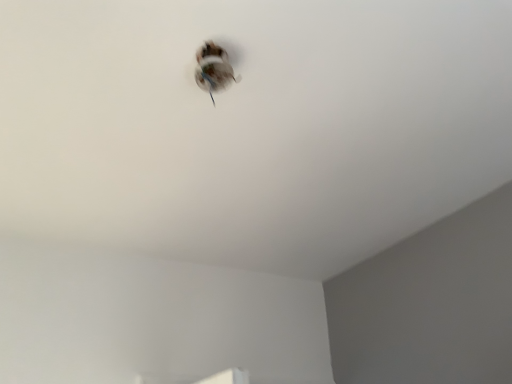
Find the location of `white matte bird at center`. white matte bird at center is located at coordinates (213, 69).

The width and height of the screenshot is (512, 384). Describe the element at coordinates (213, 69) in the screenshot. I see `white matte bird at center` at that location.

What is the approximate width of white matte bird at center?

white matte bird at center is 4.80 inches in width.

The image size is (512, 384). Find the location of `white matte bird at center`. white matte bird at center is located at coordinates (x=213, y=69).